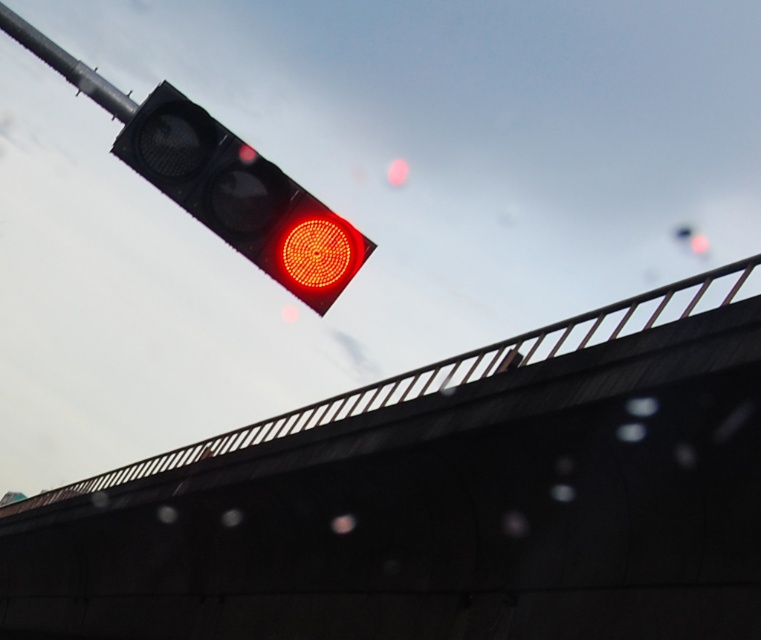
You are a delivery drone operator. Your drone is currently 7 meters above the ground. You need to fly your drone under the black metal overpass at upper center. Can your drone safely pass under it?

The distance of black metal overpass at upper center from camera is 6.94 meters. Since your drone is at 7 meters above the ground, it cannot safely pass under the black metal overpass at upper center as it would collide with the overpass.